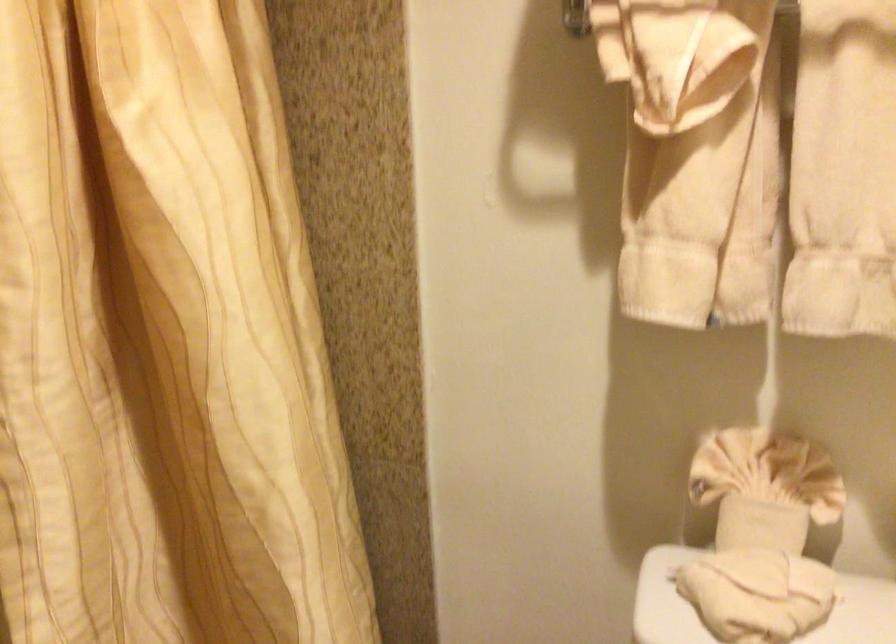
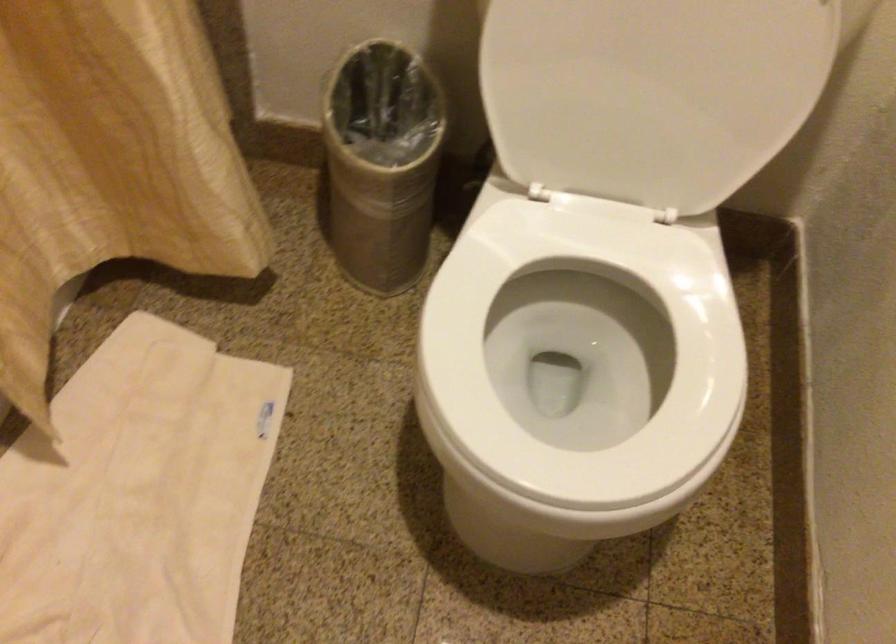
How did the camera likely rotate?

The rotation direction of the camera is right-down.